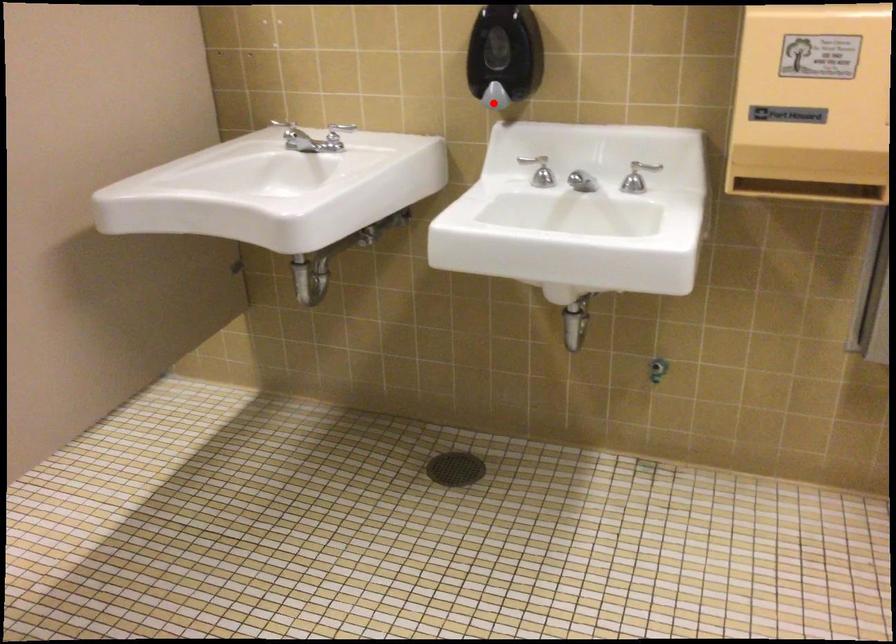
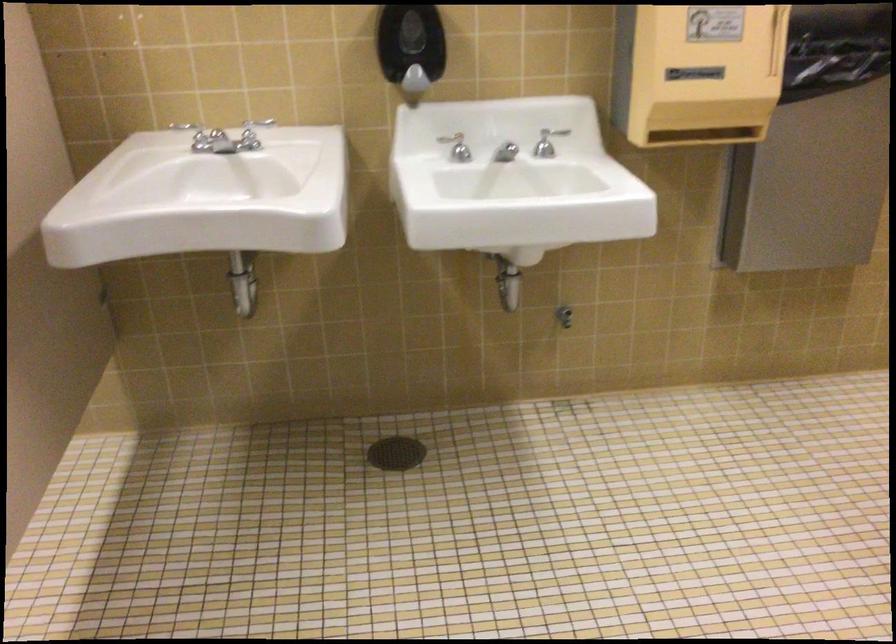
Locate, in the second image, the point that corresponds to the highlighted location in the first image.

(412, 84)